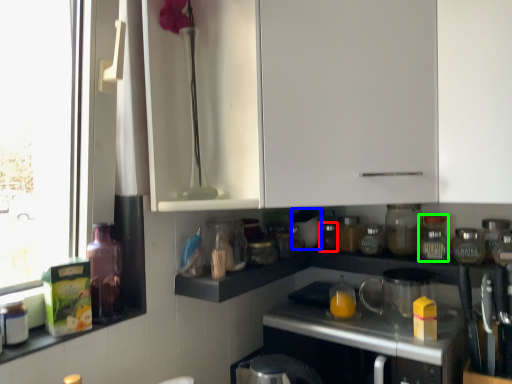
Question: Which is farther away from bottle (highlighted by a red box)? appliance (highlighted by a blue box) or bottle (highlighted by a green box)?

Choices:
 (A) appliance
 (B) bottle

Answer: (B)